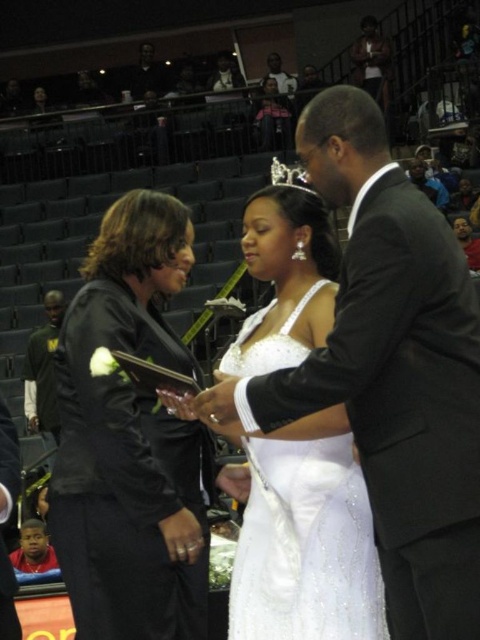
Question: Estimate the real-world distances between objects in this image. Which object is closer to the silver metallic tiara at center?

Choices:
 (A) black satin jacket at left
 (B) white satin dress at center

Answer: (B)

Question: Does black satin jacket at left appear on the right side of white satin dress at center?

Choices:
 (A) yes
 (B) no

Answer: (B)

Question: Is white satin dress at center smaller than dark green jersey at left?

Choices:
 (A) no
 (B) yes

Answer: (B)

Question: Which of these objects is positioned closest to the silver metallic tiara at center?

Choices:
 (A) white satin dress at center
 (B) dark green jersey at left
 (C) black satin jacket at left

Answer: (A)

Question: Which point is closer to the camera taking this photo?

Choices:
 (A) (288, 499)
 (B) (94, 588)

Answer: (A)

Question: Is white satin dress at center thinner than silver metallic tiara at center?

Choices:
 (A) yes
 (B) no

Answer: (A)